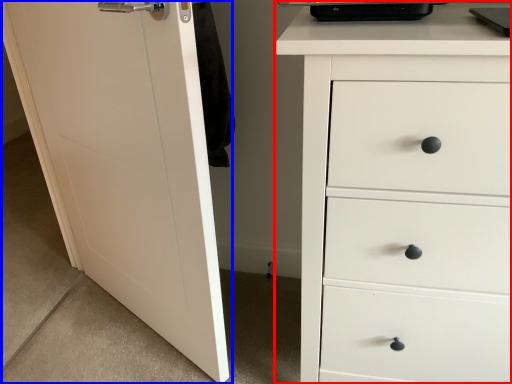
Question: Which of the following is the closest to the observer, chest of drawers (highlighted by a red box) or door (highlighted by a blue box)?

Choices:
 (A) chest of drawers
 (B) door

Answer: (A)